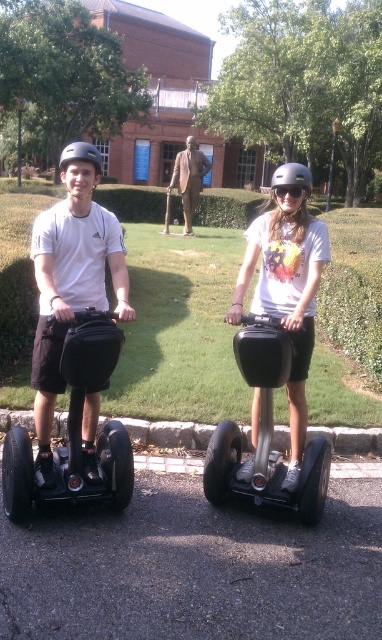
Which is behind, point (244, 365) or point (299, 173)?

Point (299, 173)

Does point (265, 332) come farther from viewer compared to point (281, 180)?

No, (265, 332) is in front of (281, 180).

What do you see at coordinates (265, 433) in the screenshot? The height and width of the screenshot is (640, 382). I see `black matte scooter at center` at bounding box center [265, 433].

At what (x,y) coordinates should I click in order to perform the action: click on black matte scooter at center. Please return your answer as a coordinate pair (x, y). Looking at the image, I should click on (265, 433).

Which is behind, point (255, 227) or point (276, 195)?

Point (255, 227)

Which is in front, point (271, 289) or point (291, 192)?

Point (291, 192) is in front.

At what (x,y) coordinates should I click in order to perform the action: click on matte white helmet at center. Please return your answer as a coordinate pair (x, y). This screenshot has width=382, height=640. Looking at the image, I should click on (286, 289).

Does brown polished wood statue at center have a greater height compared to transparent yellow goggles at center?

Yes, brown polished wood statue at center is taller than transparent yellow goggles at center.

Does brown polished wood statue at center appear under transparent yellow goggles at center?

No, brown polished wood statue at center is not below transparent yellow goggles at center.

Between point (195, 157) and point (302, 189), which one is positioned behind?

The point (195, 157) is more distant.

At what (x,y) coordinates should I click in order to perform the action: click on brown polished wood statue at center. Please return your answer as a coordinate pair (x, y). The width and height of the screenshot is (382, 640). Looking at the image, I should click on (189, 179).